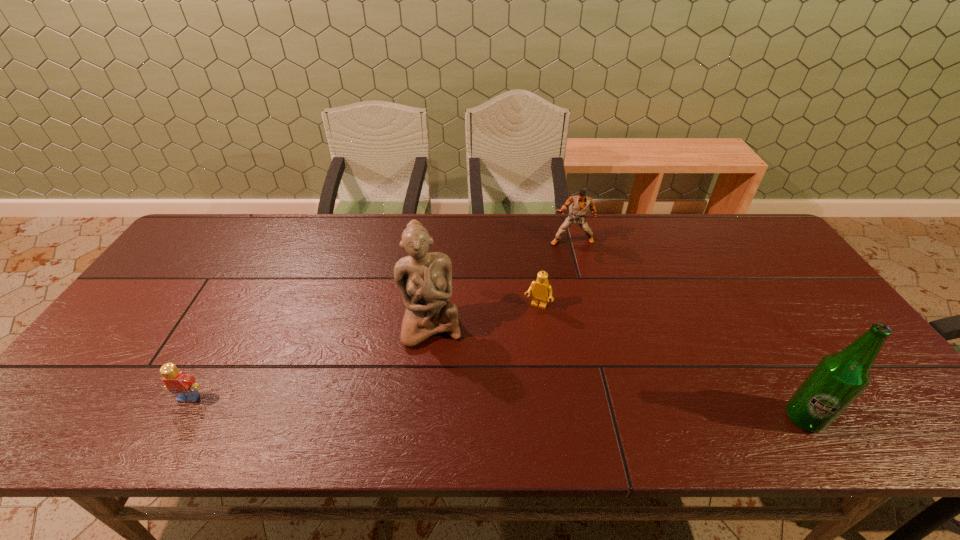
I want to click on vacant space located 0.070m on the face of the right Lego, so click(x=525, y=330).

You are a GUI agent. You are given a task and a screenshot of the screen. Output one action in this format:
    pyautogui.click(x=<x>, y=<y>)
    Task: Click on the free point located 0.270m on the front-facing side of the fourth object from left to right
    This screenshot has width=960, height=540.
    Given the screenshot: What is the action you would take?
    pyautogui.click(x=574, y=307)

In order to click on vacant area situated 0.360m on the front-facing side of the fourth object from left to right in this screenshot , I will do `click(576, 332)`.

This screenshot has height=540, width=960. I want to click on free space located on the front-facing side of the fourth object from left to right, so click(571, 257).

This screenshot has width=960, height=540. What are the coordinates of `free space located on the front-facing side of the fourth object from right to left` in the screenshot? It's located at (444, 401).

The image size is (960, 540). In order to click on vacant space located on the front-facing side of the fourth object from right to left in this screenshot , I will do click(439, 372).

The width and height of the screenshot is (960, 540). What are the coordinates of `vacant space located 0.070m on the front-facing side of the fourth object from right to left` in the screenshot? It's located at (439, 372).

The height and width of the screenshot is (540, 960). Identify the location of object at the far edge. (580, 205).

Image resolution: width=960 pixels, height=540 pixels. I want to click on Lego located in the near edge section of the desktop, so click(177, 382).

I want to click on beer bottle that is at the near edge, so click(838, 379).